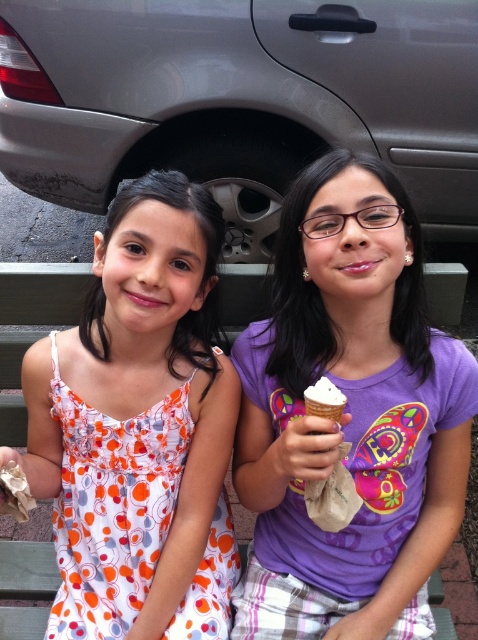
Is purple cotton shirt at center further to the viewer compared to white waffle cone at center?

Yes, it is behind white waffle cone at center.

Between point (243, 580) and point (328, 419), which one is positioned behind?

The point (243, 580) is behind.

Where is `purple cotton shirt at center`? This screenshot has width=478, height=640. purple cotton shirt at center is located at coordinates (349, 417).

Can you confirm if green wood park bench at center is positioned to the right of white waffle cone at center?

Incorrect, green wood park bench at center is not on the right side of white waffle cone at center.

Describe the element at coordinates (34, 307) in the screenshot. I see `green wood park bench at center` at that location.

Is point (21, 298) closer to camera compared to point (316, 406)?

That is False.

Locate an element on the screen. This screenshot has height=640, width=478. green wood park bench at center is located at coordinates (34, 307).

Does silver metallic car at center have a lesser height compared to green wood park bench at center?

No.

Is silver metallic car at center smaller than green wood park bench at center?

No.

At what (x,y) coordinates should I click in order to perform the action: click on silver metallic car at center. Please return your answer as a coordinate pair (x, y). The image size is (478, 640). Looking at the image, I should click on (240, 93).